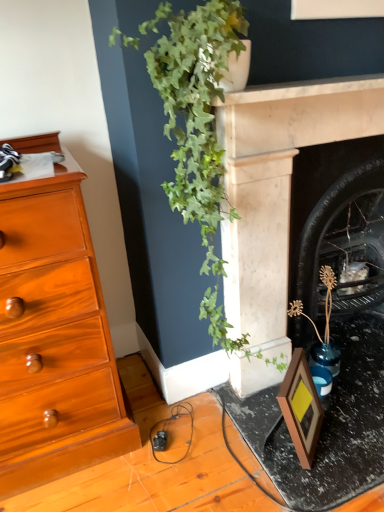
Find the location of a particular element. free space to the left of wooden picture frame at lower right is located at coordinates (248, 423).